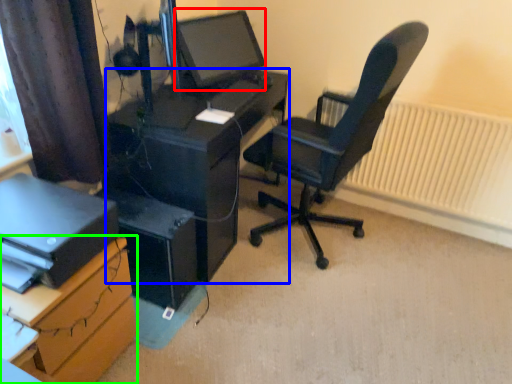
Question: Which is farther away from computer monitor (highlighted by a red box)? desk (highlighted by a blue box) or desk (highlighted by a green box)?

Choices:
 (A) desk
 (B) desk

Answer: (B)